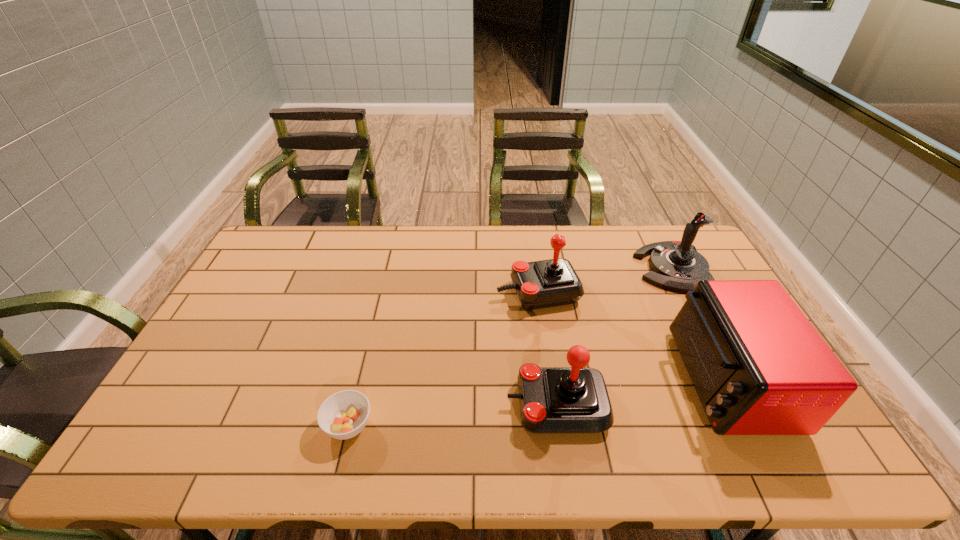
Identify the location of vacant space that's between the nearest joystick and the rightmost joystick. The height and width of the screenshot is (540, 960). (614, 336).

Locate an element on the screen. The height and width of the screenshot is (540, 960). free space between the nearest joystick and the soup bowl is located at coordinates (453, 415).

Image resolution: width=960 pixels, height=540 pixels. Find the location of `the second closest object relative to the toaster oven`. the second closest object relative to the toaster oven is located at coordinates (575, 399).

What are the coordinates of `object that is the fourth closest to the toaster oven` in the screenshot? It's located at (343, 415).

The height and width of the screenshot is (540, 960). In order to click on joystick that stands as the second closest to the nearest joystick in this screenshot , I will do `click(676, 265)`.

Where is `joystick that is the third closest to the toaster oven`? joystick that is the third closest to the toaster oven is located at coordinates (548, 283).